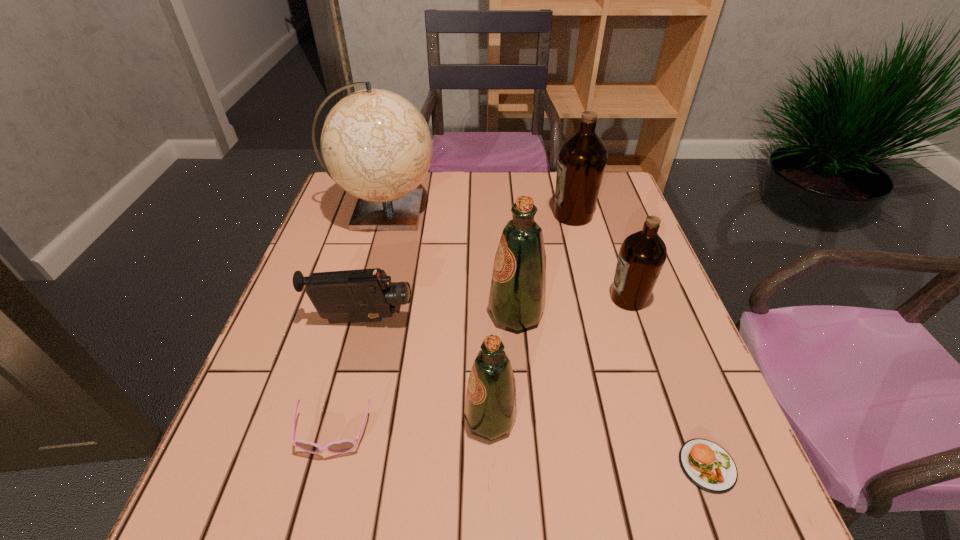
You are a GUI agent. You are given a task and a screenshot of the screen. Output one action in this format:
    pyautogui.click(x=<x>, y=<y>)
    Task: Click on the closest object relative to the sunglasses
    Image resolution: width=960 pixels, height=540 pixels.
    Given the screenshot: What is the action you would take?
    pyautogui.click(x=490, y=410)

Locate which object ranks second in proximity to the farther green olive oil. Please provide its 2D coordinates. Your answer should be formatted as a tuple, i.e. [(x, y)], where the tuple contains the x and y coordinates of a point satisfying the conditions above.

[(642, 255)]

Point out which olive oil is positioned as the third nearest to the black camcorder. Please provide its 2D coordinates. Your answer should be formatted as a tuple, i.e. [(x, y)], where the tuple contains the x and y coordinates of a point satisfying the conditions above.

[(642, 255)]

Where is `olive oil that stands as the closest to the camcorder`? olive oil that stands as the closest to the camcorder is located at coordinates (518, 287).

The width and height of the screenshot is (960, 540). Identify the location of free space that satisfies the following two spatial constraints: 1. on the front-facing side of the nearer green olive oil; 2. on the front-facing side of the seventh tallest object. (491, 435).

Image resolution: width=960 pixels, height=540 pixels. Identify the location of vacant point that satisfies the following two spatial constraints: 1. on the label of the patty; 2. on the left side of the bigger brown olive oil. (639, 465).